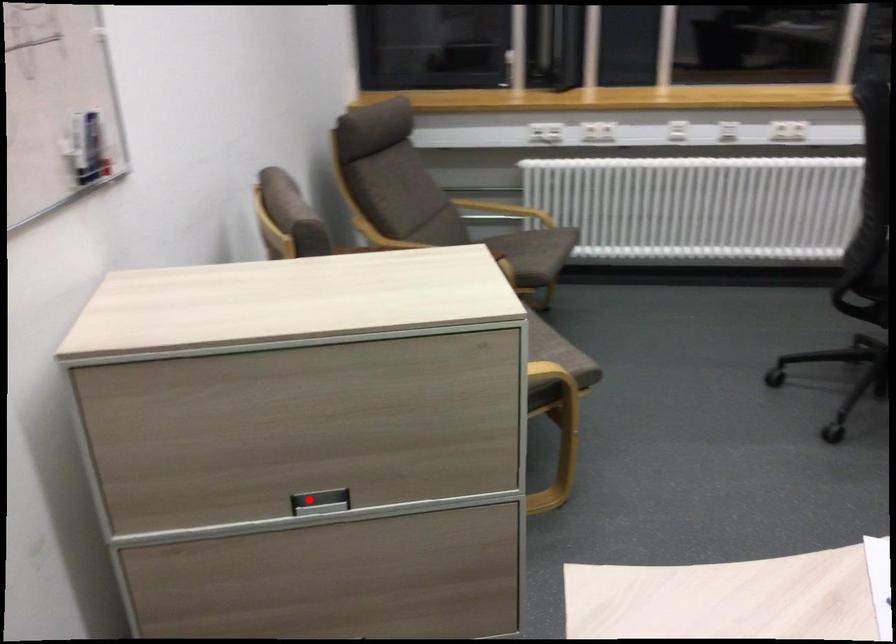
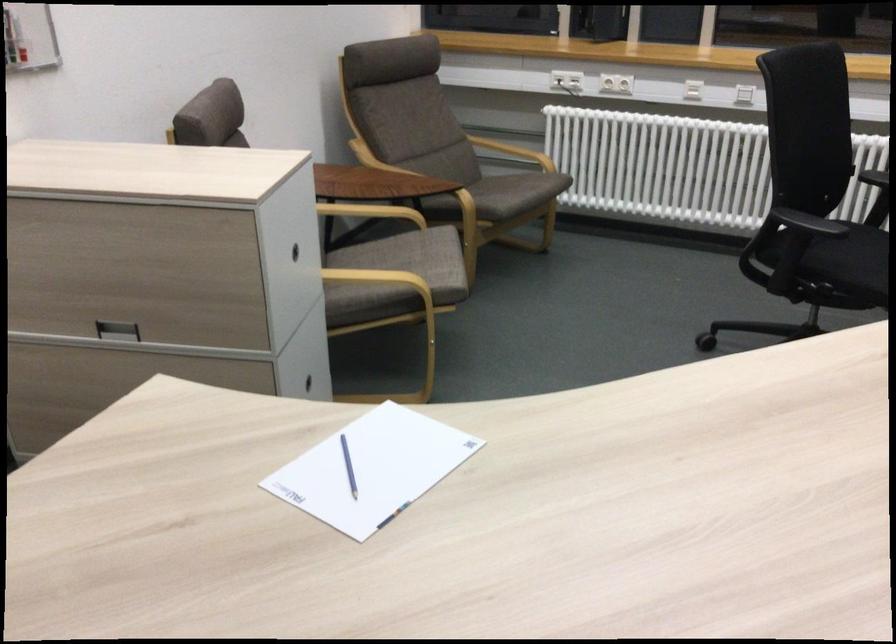
The point at the highlighted location is marked in the first image. Where is the corresponding point in the second image?

(116, 330)